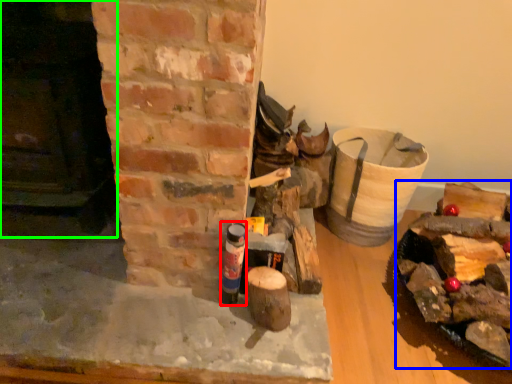
Question: Based on their relative distances, which object is nearer to bottle (highlighted by a red box)? Choose from debris (highlighted by a blue box) and fireplace (highlighted by a green box).

Choices:
 (A) debris
 (B) fireplace

Answer: (B)